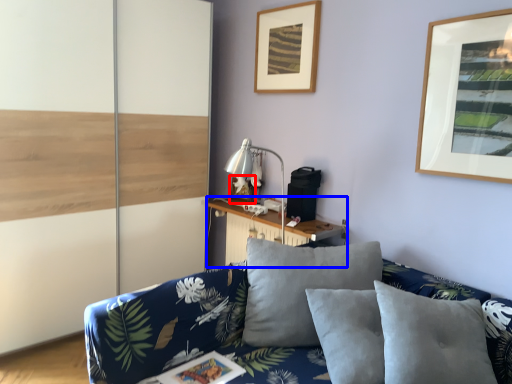
Question: Which object is closer to the camera taking this photo, picture frame (highlighted by a red box) or table (highlighted by a blue box)?

Choices:
 (A) picture frame
 (B) table

Answer: (B)